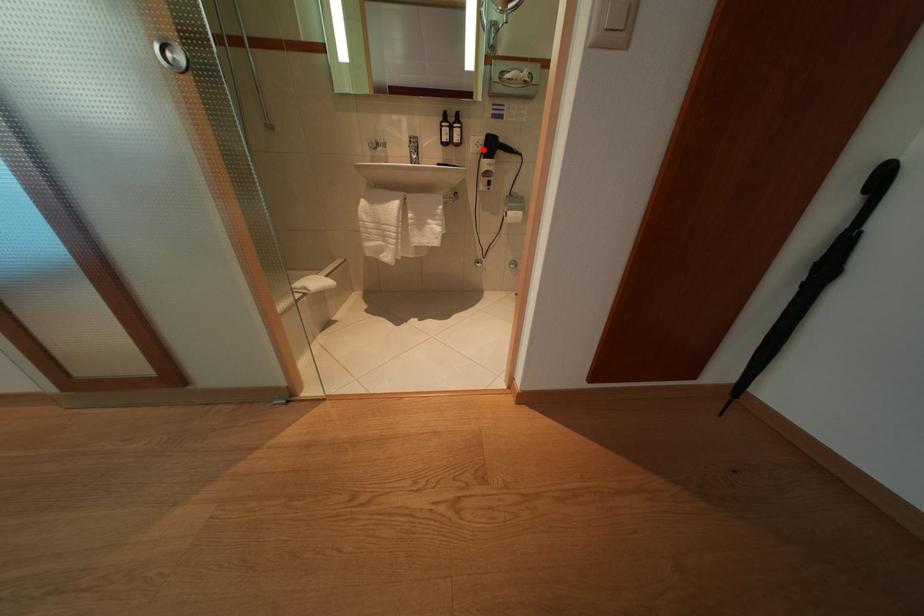
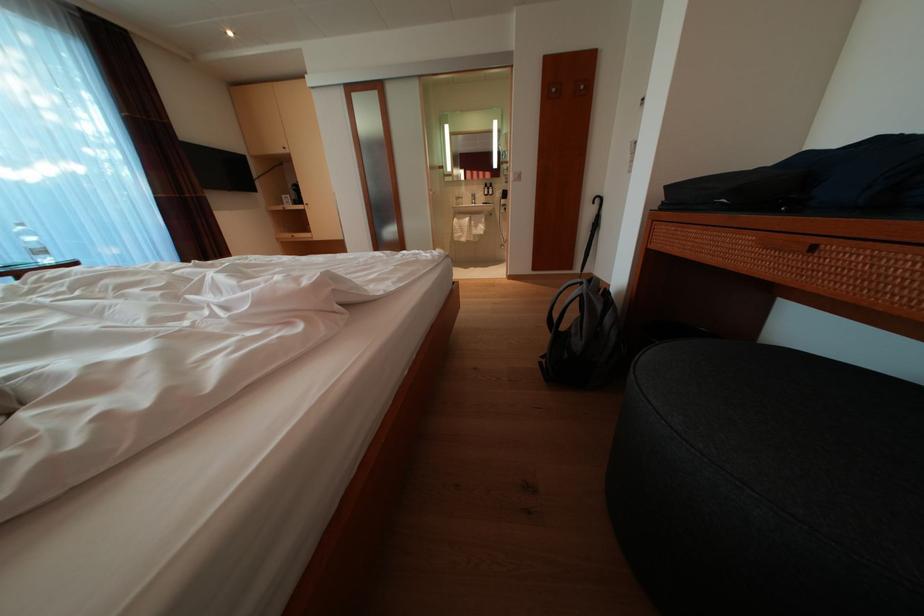
Question: I am providing you with two images of the same scene from different viewpoints. Image1 has a red point marked. In image2, the corresponding 3D location appears at what relative position? Reply with the corresponding letter.

Choices:
 (A) Closer
 (B) Farther

Answer: (A)